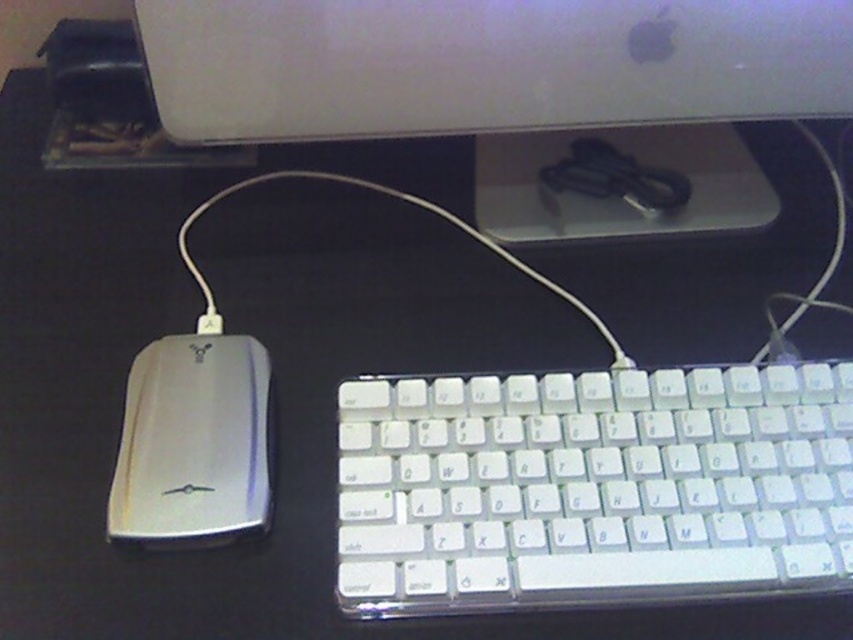
In the scene shown: Which is more to the right, white plastic keyboard at lower center or satin white monitor at upper center?

white plastic keyboard at lower center

Does white plastic keyboard at lower center appear under satin white monitor at upper center?

Yes.

Identify the location of white plastic keyboard at lower center. The width and height of the screenshot is (853, 640). (593, 486).

Based on the photo, can you confirm if silver metallic mouse at left is smaller than white cable at lower left?

Indeed, silver metallic mouse at left has a smaller size compared to white cable at lower left.

Is silver metallic mouse at left below white cable at lower left?

Yes, silver metallic mouse at left is below white cable at lower left.

The width and height of the screenshot is (853, 640). I want to click on silver metallic mouse at left, so click(x=193, y=442).

From the picture: Is white plastic keyboard at lower center behind silver metallic mouse at left?

That is False.

Based on the photo, does white plastic keyboard at lower center have a lesser height compared to silver metallic mouse at left?

No.

Between point (787, 456) and point (113, 483), which one is positioned in front?

Point (113, 483)

Find the location of a particular element. The height and width of the screenshot is (640, 853). white plastic keyboard at lower center is located at coordinates (593, 486).